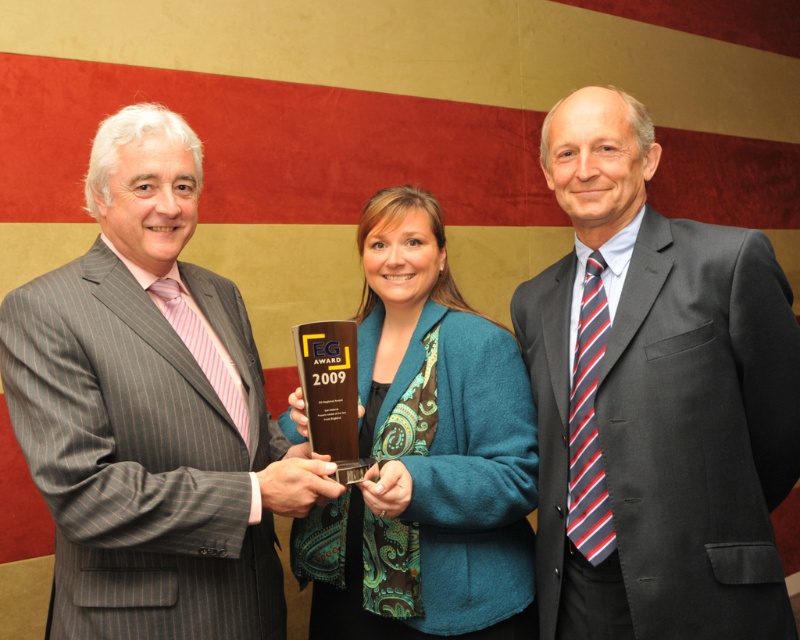
Question: Can you confirm if dark gray suit at right is bigger than gray pinstripe suit at center?

Choices:
 (A) no
 (B) yes

Answer: (A)

Question: Among these objects, which one is farthest from the camera?

Choices:
 (A) gray pinstripe suit at center
 (B) dark gray suit at right
 (C) teal fabric jacket at center

Answer: (C)

Question: Can you confirm if dark gray suit at right is bigger than gray pinstripe suit at center?

Choices:
 (A) no
 (B) yes

Answer: (A)

Question: Among these points, which one is nearest to the camera?

Choices:
 (A) [632, 536]
 (B) [162, 429]
 (C) [416, 531]

Answer: (B)

Question: Among these points, which one is nearest to the camera?

Choices:
 (A) (393, 314)
 (B) (728, 516)
 (C) (206, 308)

Answer: (B)

Question: Does gray pinstripe suit at center have a larger size compared to teal fabric jacket at center?

Choices:
 (A) no
 (B) yes

Answer: (A)